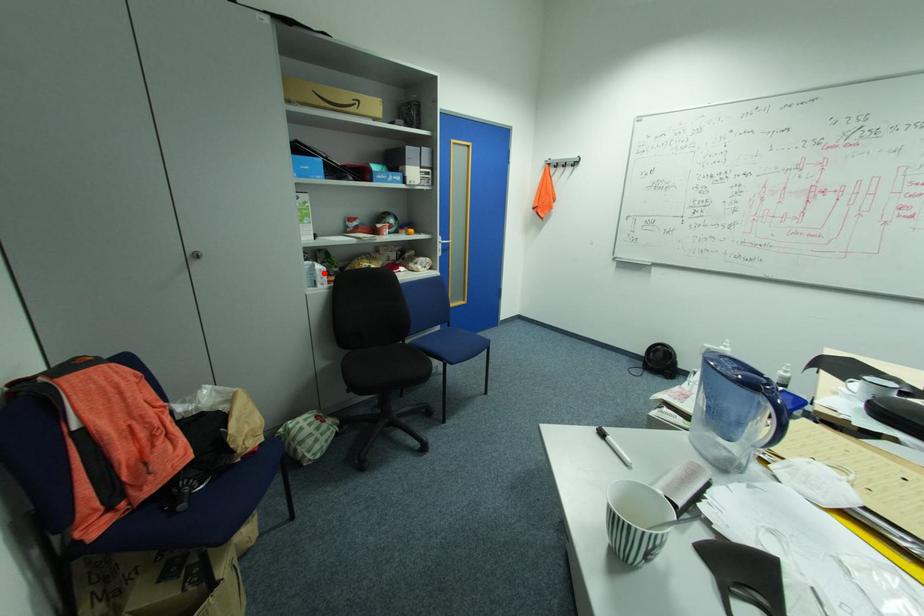
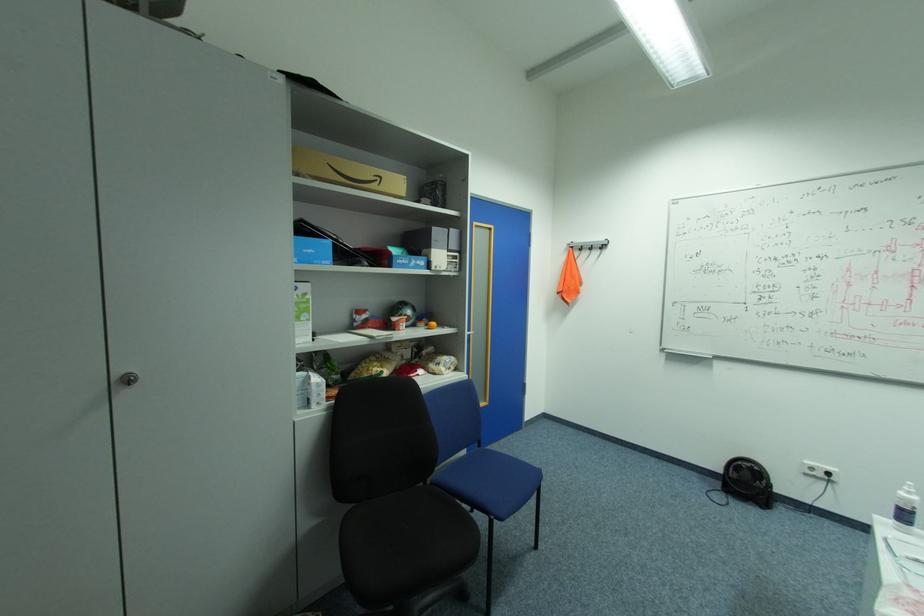
Where in the second image is the point corresponding to the highlighted location from the first image?

(321, 387)